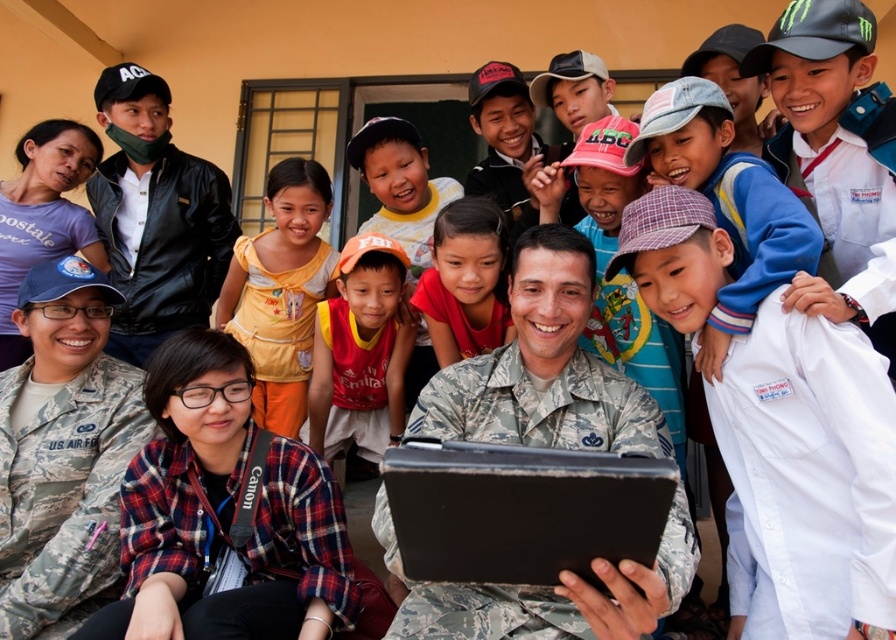
Who is positioned more to the right, black matte laptop at center or red/yellow jersey at center?

From the viewer's perspective, black matte laptop at center appears more on the right side.

Who is more distant from viewer, (531, 561) or (345, 266)?

The point (345, 266) is more distant.

You are a GUI agent. You are given a task and a screenshot of the screen. Output one action in this format:
    pyautogui.click(x=<x>, y=<y>)
    Task: Click on the black matte laptop at center
    The width and height of the screenshot is (896, 640).
    Given the screenshot: What is the action you would take?
    pyautogui.click(x=521, y=509)

Is white cotton shirt at center shorter than black matte laptop at center?

No.

Which is behind, point (803, 468) or point (436, 548)?

Point (803, 468)

You are a GUI agent. You are given a task and a screenshot of the screen. Output one action in this format:
    pyautogui.click(x=<x>, y=<y>)
    Task: Click on the white cotton shirt at center
    
    Given the screenshot: What is the action you would take?
    pyautogui.click(x=811, y=474)

Where is `white cotton shirt at center`? This screenshot has width=896, height=640. white cotton shirt at center is located at coordinates (811, 474).

Is camouflage uniform at center above red/yellow jersey at center?

Actually, camouflage uniform at center is below red/yellow jersey at center.

Does point (383, 529) come behind point (385, 275)?

No.

Between point (612, 605) and point (342, 289), which one is positioned behind?

The point (342, 289) is more distant.

The width and height of the screenshot is (896, 640). Find the location of `camouflage uniform at center`. camouflage uniform at center is located at coordinates click(544, 369).